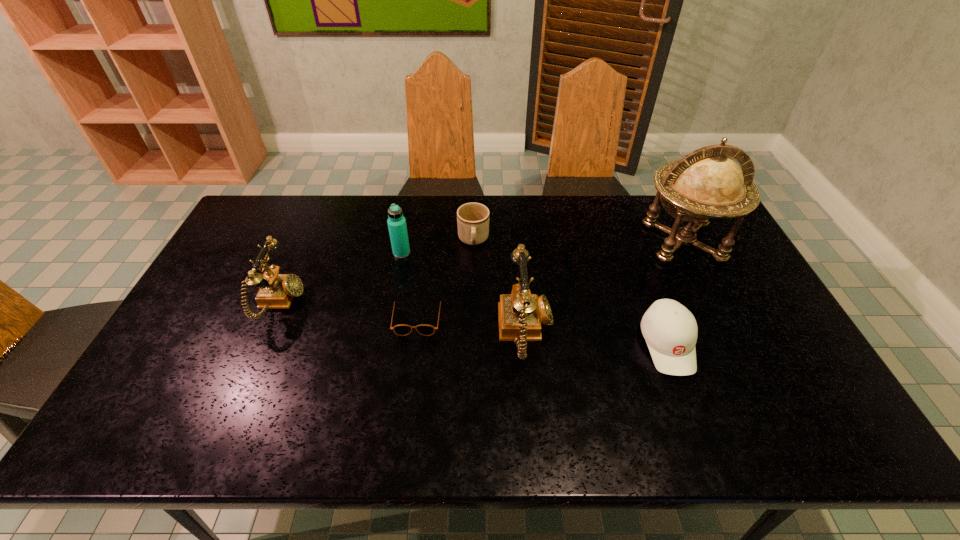
With all telephones evenly spaced, where should an extra telephone be placed on the right to continue the pattern? Please point out a vacant space. Please provide its 2D coordinates. Your answer should be formatted as a tuple, i.e. [(x, y)], where the tuple contains the x and y coordinates of a point satisfying the conditions above.

[(805, 366)]